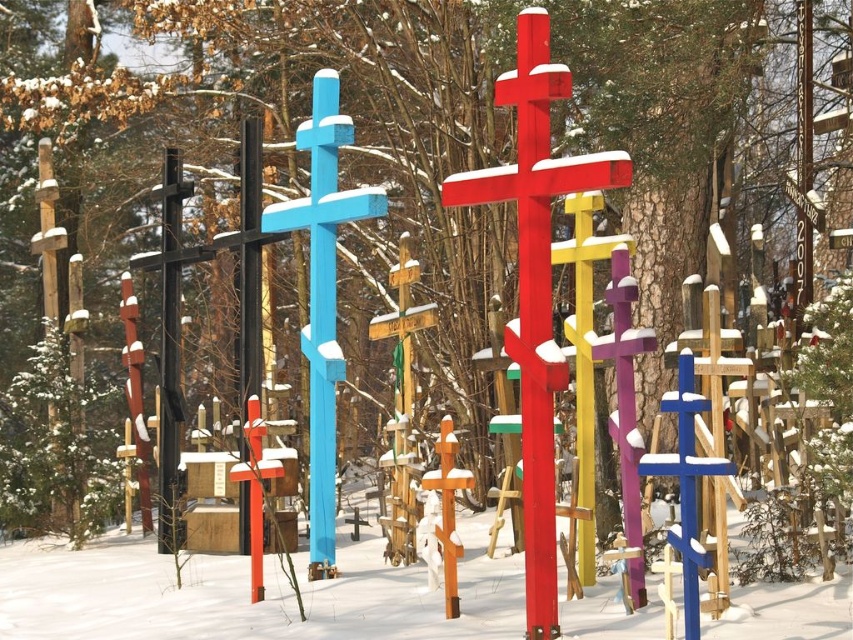
Is smooth red wooden cross at center to the left of wooden cross at center from the viewer's perspective?

Incorrect, smooth red wooden cross at center is not on the left side of wooden cross at center.

Locate an element on the screen. The width and height of the screenshot is (853, 640). smooth red wooden cross at center is located at coordinates (537, 284).

You are a GUI agent. You are given a task and a screenshot of the screen. Output one action in this format:
    pyautogui.click(x=<x>, y=<y>)
    Task: Click on the smooth red wooden cross at center
    The image size is (853, 640).
    Given the screenshot: What is the action you would take?
    pyautogui.click(x=537, y=284)

Locate an element on the screen. Image resolution: width=853 pixels, height=640 pixels. smooth red wooden cross at center is located at coordinates (537, 284).

Between blue painted wood cross at center and wooden cross at center, which one appears on the right side from the viewer's perspective?

From the viewer's perspective, wooden cross at center appears more on the right side.

The image size is (853, 640). I want to click on blue painted wood cross at center, so click(323, 296).

Can you confirm if smooth red wooden cross at center is positioned to the left of blue wooden cross at center-right?

Yes, smooth red wooden cross at center is to the left of blue wooden cross at center-right.

Can you confirm if smooth red wooden cross at center is positioned below blue wooden cross at center-right?

Incorrect, smooth red wooden cross at center is not positioned below blue wooden cross at center-right.

This screenshot has width=853, height=640. Describe the element at coordinates (537, 284) in the screenshot. I see `smooth red wooden cross at center` at that location.

Find the location of a particular element. This screenshot has width=853, height=640. smooth red wooden cross at center is located at coordinates (537, 284).